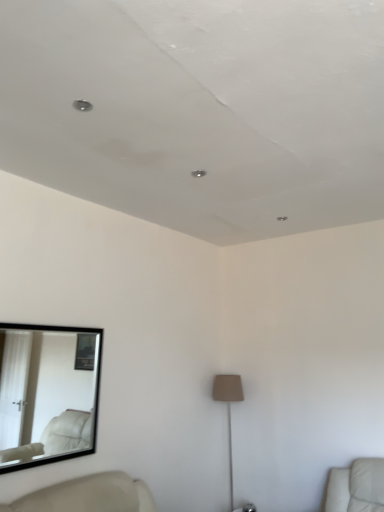
The width and height of the screenshot is (384, 512). Describe the element at coordinates (228, 410) in the screenshot. I see `beige fabric lamp at center` at that location.

Where is `beige fabric lamp at center`? The height and width of the screenshot is (512, 384). beige fabric lamp at center is located at coordinates (228, 410).

This screenshot has height=512, width=384. What do you see at coordinates (47, 393) in the screenshot?
I see `black framed mirror at left` at bounding box center [47, 393].

Locate an element on the screen. The width and height of the screenshot is (384, 512). black framed mirror at left is located at coordinates (47, 393).

What is the approximate height of black framed mirror at left?

black framed mirror at left is 84.67 centimeters tall.

Identify the location of beige fabric lamp at center. The width and height of the screenshot is (384, 512). (228, 410).

Considering the relative positions of black framed mirror at left and beige fabric lamp at center in the image provided, is black framed mirror at left to the right of beige fabric lamp at center from the viewer's perspective?

In fact, black framed mirror at left is to the left of beige fabric lamp at center.

Consider the image. Considering the relative positions of black framed mirror at left and beige fabric lamp at center in the image provided, is black framed mirror at left behind beige fabric lamp at center?

That is False.

Does point (15, 351) come in front of point (224, 400)?

Yes, it is in front of point (224, 400).

From the image's perspective, is black framed mirror at left above beige fabric lamp at center?

Indeed, from the image's perspective, black framed mirror at left is shown above beige fabric lamp at center.

From a real-world perspective, does black framed mirror at left sit lower than beige fabric lamp at center?

No.

Looking at their sizes, would you say black framed mirror at left is wider or thinner than beige fabric lamp at center?

Clearly, black framed mirror at left has less width compared to beige fabric lamp at center.

Considering the sizes of objects black framed mirror at left and beige fabric lamp at center in the image provided, who is shorter, black framed mirror at left or beige fabric lamp at center?

black framed mirror at left is shorter.

Who is smaller, black framed mirror at left or beige fabric lamp at center?

black framed mirror at left.

Can beige fabric lamp at center be found inside black framed mirror at left?

No, beige fabric lamp at center is located outside of black framed mirror at left.

Is black framed mirror at left placed right next to beige fabric lamp at center?

black framed mirror at left and beige fabric lamp at center are not in contact.

In the scene shown: Is beige fabric lamp at center at the back of black framed mirror at left?

No, black framed mirror at left is not facing the opposite direction of beige fabric lamp at center.

Find the location of a particular element. Image resolution: width=384 pixels, height=512 pixels. lamp that is below the black framed mirror at left (from the image's perspective) is located at coordinates (228, 410).

Would you say beige fabric lamp at center is to the left or to the right of black framed mirror at left in the picture?

beige fabric lamp at center is to the right of black framed mirror at left.

Is beige fabric lamp at center positioned before black framed mirror at left?

No, beige fabric lamp at center is further to the viewer.

Is point (223, 382) positioned in front of point (93, 415)?

That is False.

From the image's perspective, between beige fabric lamp at center and black framed mirror at left, which one is located above?

black framed mirror at left is shown above in the image.

From a real-world perspective, is beige fabric lamp at center above or below black framed mirror at left?

beige fabric lamp at center is below black framed mirror at left.

Which object is wider, beige fabric lamp at center or black framed mirror at left?

With larger width is beige fabric lamp at center.

Considering the sizes of beige fabric lamp at center and black framed mirror at left in the image, is beige fabric lamp at center taller or shorter than black framed mirror at left?

Considering their sizes, beige fabric lamp at center has more height than black framed mirror at left.

Is beige fabric lamp at center smaller than black framed mirror at left?

No, beige fabric lamp at center is not smaller than black framed mirror at left.

Is beige fabric lamp at center positioned beyond the bounds of black framed mirror at left?

Yes, beige fabric lamp at center is not within black framed mirror at left.

Is the surface of beige fabric lamp at center in direct contact with black framed mirror at left?

No, beige fabric lamp at center is not making contact with black framed mirror at left.

Is beige fabric lamp at center turned away from black framed mirror at left?

That's not correct — beige fabric lamp at center is not looking away from black framed mirror at left.

Locate an element on the screen. This screenshot has width=384, height=512. mirror positioned vertically above the beige fabric lamp at center (from a real-world perspective) is located at coordinates (47, 393).

Where is `lamp on the right of black framed mirror at left`? The image size is (384, 512). lamp on the right of black framed mirror at left is located at coordinates (228, 410).

Where is `lamp located below the black framed mirror at left (from the image's perspective)`? lamp located below the black framed mirror at left (from the image's perspective) is located at coordinates (228, 410).